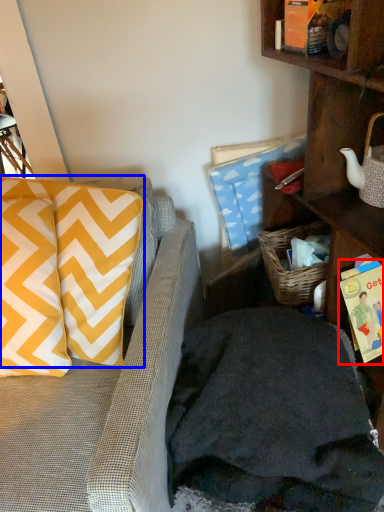
Question: Which object appears closest to the camera in this image, book (highlighted by a red box) or pillow (highlighted by a blue box)?

Choices:
 (A) book
 (B) pillow

Answer: (B)